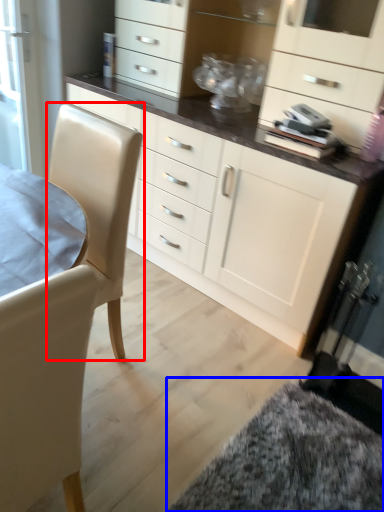
Question: Among these objects, which one is farthest to the camera, swivel chair (highlighted by a red box) or wide (highlighted by a blue box)?

Choices:
 (A) swivel chair
 (B) wide

Answer: (B)